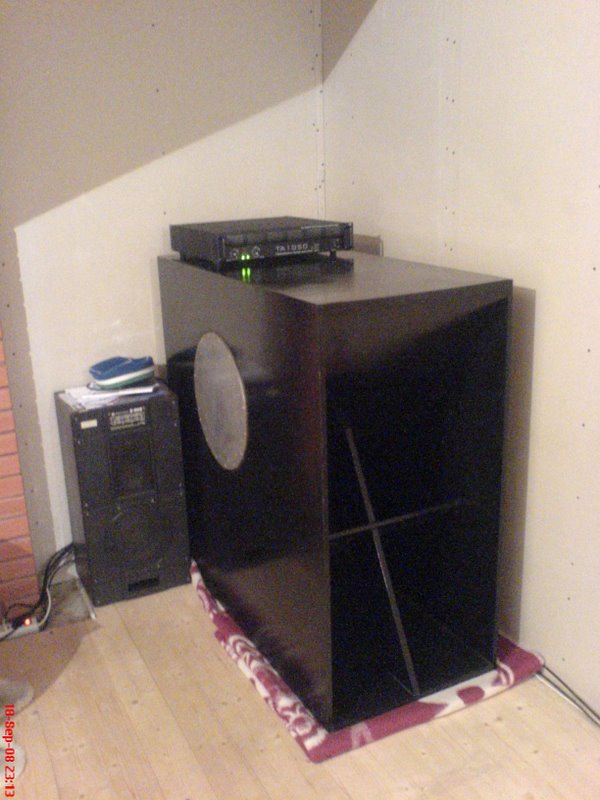
Where is `purple wall`? The height and width of the screenshot is (800, 600). purple wall is located at coordinates (151, 105).